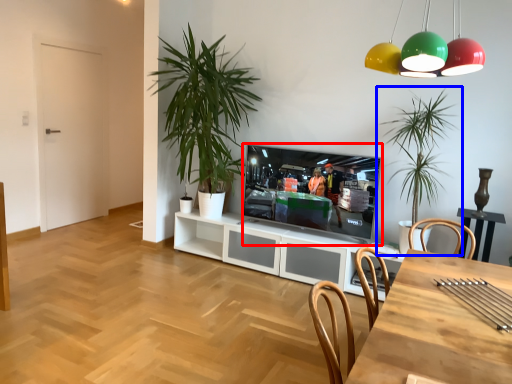
Question: Which object is further to the camera taking this photo, television (highlighted by a red box) or houseplant (highlighted by a blue box)?

Choices:
 (A) television
 (B) houseplant

Answer: (A)